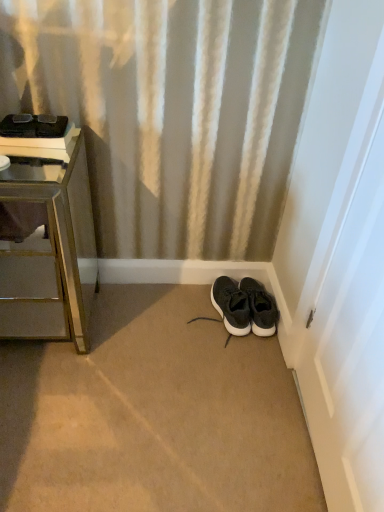
Question: From a real-world perspective, is black suede sneakers at lower right, which is counted as the 1th footwear, starting from the right, positioned above or below brushed metal nightstand at left?

Choices:
 (A) below
 (B) above

Answer: (A)

Question: Based on their sizes in the image, would you say black suede sneakers at lower right, which is counted as the 1th footwear, starting from the right, is bigger or smaller than brushed metal nightstand at left?

Choices:
 (A) big
 (B) small

Answer: (B)

Question: Considering the real-world distances, which object is closest to the white glossy door at right?

Choices:
 (A) black fabric sneakers at center, the first footwear viewed from the left
 (B) black suede sneakers at lower right, which is counted as the 1th footwear, starting from the right
 (C) brushed metal nightstand at left

Answer: (B)

Question: Considering the real-world distances, which object is farthest from the brushed metal nightstand at left?

Choices:
 (A) white glossy door at right
 (B) black fabric sneakers at center, acting as the 2th footwear starting from the right
 (C) black suede sneakers at lower right, the second footwear when ordered from left to right

Answer: (A)